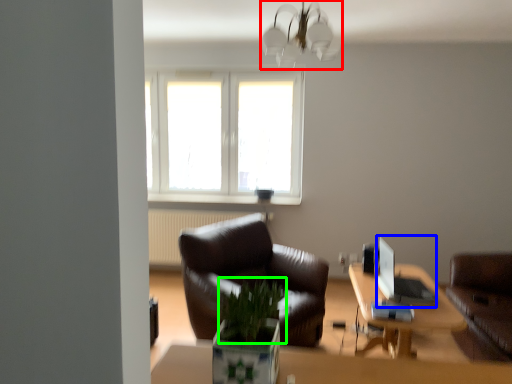
Question: Which is farther away from lamp (highlighted by a red box)? computer (highlighted by a blue box) or plant (highlighted by a green box)?

Choices:
 (A) computer
 (B) plant

Answer: (B)